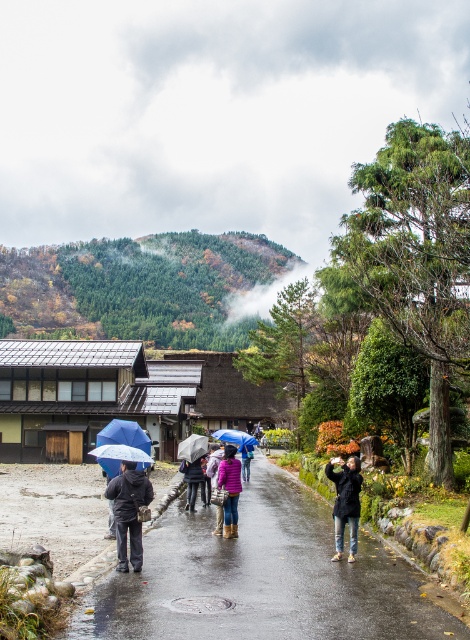
You are a photographer standing on the street. You want to take a photo that includes both the blue matte umbrella at lower center and the dark blue jacket at center. Which object should you zoom in on to ensure both are in frame?

You should zoom in on the blue matte umbrella at lower center because it is larger than the dark blue jacket at center, making it easier to include both in the frame without cropping either.

You are a tourist walking in the rainy village street. You have a transparent plastic umbrella at center and a purple matte jacket at center. Which item can provide better rain protection?

The transparent plastic umbrella at center has a larger size compared to purple matte jacket at center, so it provides better rain protection.

You are standing at the point with coordinates (193, 448) in the image. What object is located exactly at this point?

The transparent plastic umbrella at center is located exactly at point (193, 448).